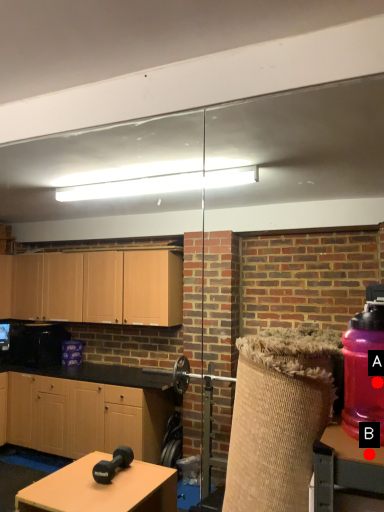
Question: Two points are circled on the image, labeled by A and B beside each circle. Which of the following is the closest to the observer?

Choices:
 (A) A is closer
 (B) B is closer

Answer: (B)